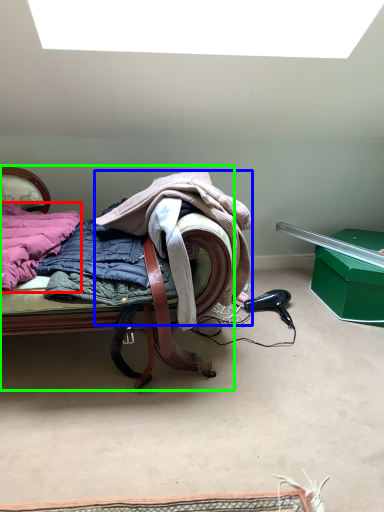
Question: Which is nearer to the underclothes (highlighted by a red box)? cloak (highlighted by a blue box) or furniture (highlighted by a green box).

Choices:
 (A) cloak
 (B) furniture

Answer: (B)